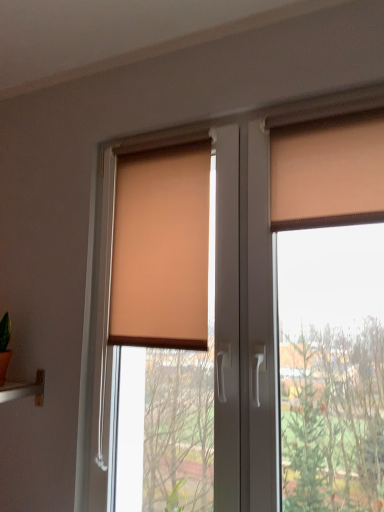
Question: Is matte orange roller blind at center to the left or to the right of beige fabric blind at center in the image?

Choices:
 (A) right
 (B) left

Answer: (A)

Question: Is point (268, 224) positioned closer to the camera than point (127, 240)?

Choices:
 (A) farther
 (B) closer

Answer: (B)

Question: Which of these objects is positioned farthest from the matte orange curtain at upper right?

Choices:
 (A) beige fabric blind at center
 (B) matte orange roller blind at center

Answer: (A)

Question: Estimate the real-world distances between objects in this image. Which object is closer to the matte orange curtain at upper right?

Choices:
 (A) matte orange roller blind at center
 (B) beige fabric blind at center

Answer: (A)